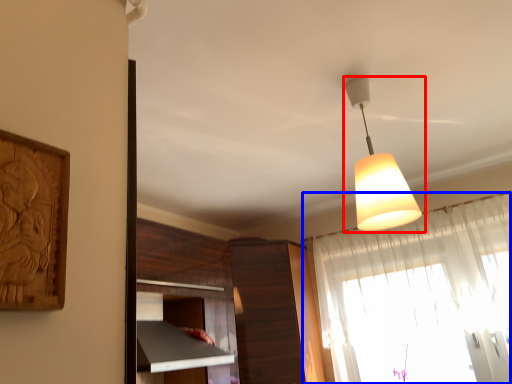
Question: Which object is further to the camera taking this photo, lamp (highlighted by a red box) or curtain (highlighted by a blue box)?

Choices:
 (A) lamp
 (B) curtain

Answer: (B)